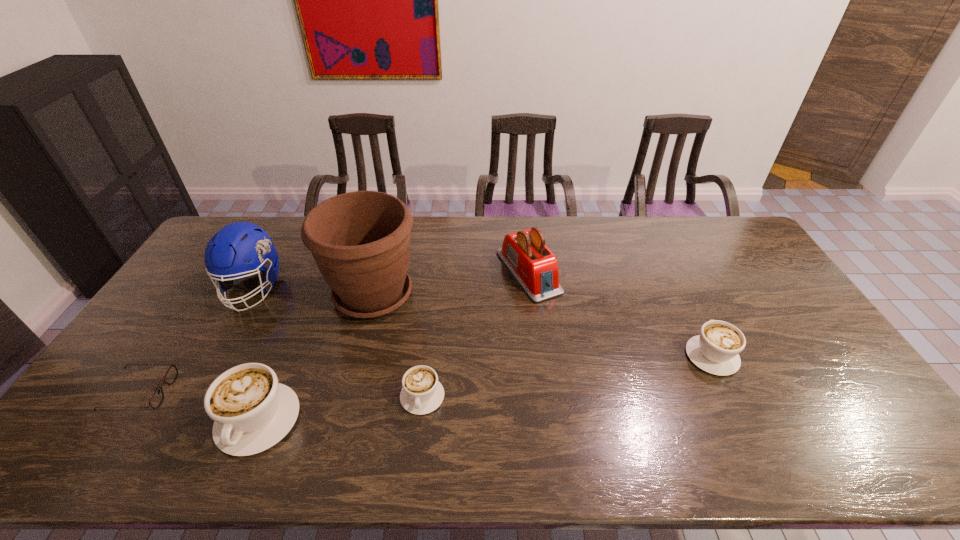
The image size is (960, 540). In order to click on football helmet that is at the left edge in this screenshot , I will do `click(238, 242)`.

Identify the location of sunglasses positioned at the left edge. Image resolution: width=960 pixels, height=540 pixels. (156, 399).

The image size is (960, 540). What are the coordinates of `object located in the near left corner section of the desktop` in the screenshot? It's located at (156, 399).

You are a GUI agent. You are given a task and a screenshot of the screen. Output one action in this format:
    pyautogui.click(x=<x>, y=<y>)
    Task: Click on the vacant region at the far edge of the desktop
    The image size is (960, 540).
    Given the screenshot: What is the action you would take?
    pyautogui.click(x=579, y=217)

Find the location of a particular element. free region at the near edge is located at coordinates (692, 409).

The image size is (960, 540). Identify the location of vacant space at the left edge of the desktop. (178, 321).

Where is `vacant space at the right edge`? The image size is (960, 540). vacant space at the right edge is located at coordinates (761, 271).

Where is `free space between the fifth tallest object and the fourth tallest object`? Image resolution: width=960 pixels, height=540 pixels. free space between the fifth tallest object and the fourth tallest object is located at coordinates (485, 388).

You are a GUI agent. You are given a task and a screenshot of the screen. Output one action in this format:
    pyautogui.click(x=<x>, y=<y>)
    Task: Click on the vacant region between the leftmost cappuccino and the tallest object
    This screenshot has height=540, width=960.
    Given the screenshot: What is the action you would take?
    pyautogui.click(x=316, y=357)

Find the location of a particular element. free area in between the fifth tallest object and the shortest cappuccino is located at coordinates (567, 376).